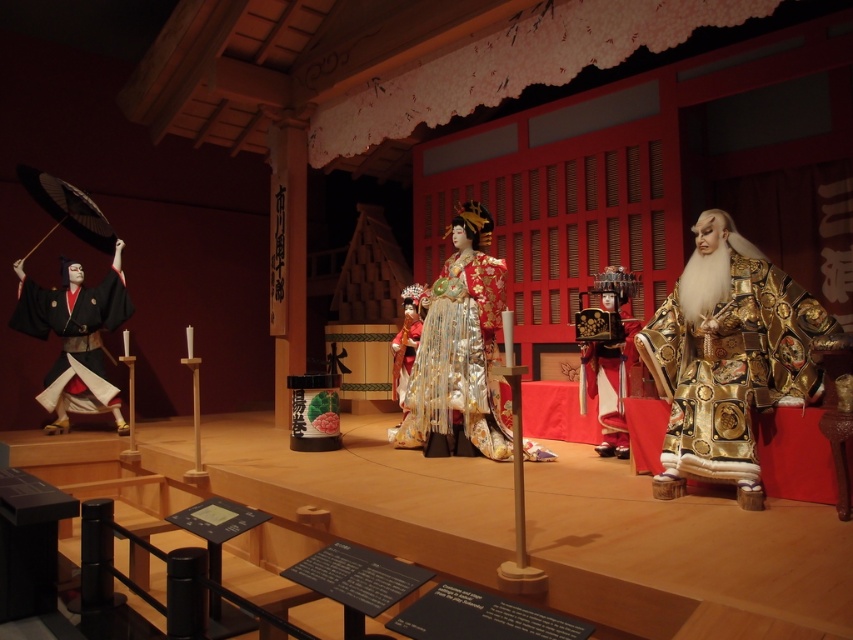
Question: Among these points, which one is farthest from the camera?

Choices:
 (A) (740, 296)
 (B) (473, 356)

Answer: (B)

Question: Can you confirm if gold shiny robe at right is thinner than matte black kimono at left?

Choices:
 (A) no
 (B) yes

Answer: (B)

Question: Is matte black kimono at left below shiny gold helmet at center?

Choices:
 (A) no
 (B) yes

Answer: (A)

Question: Which point is closer to the camera?

Choices:
 (A) pos(793,387)
 (B) pos(605,445)
 (C) pos(444,438)

Answer: (A)

Question: Based on their relative distances, which object is farther from the gold shiny robe at right?

Choices:
 (A) shiny gold helmet at center
 (B) silk kimono at center

Answer: (B)

Question: Can you confirm if gold shiny robe at right is smaller than silk kimono at center?

Choices:
 (A) no
 (B) yes

Answer: (B)